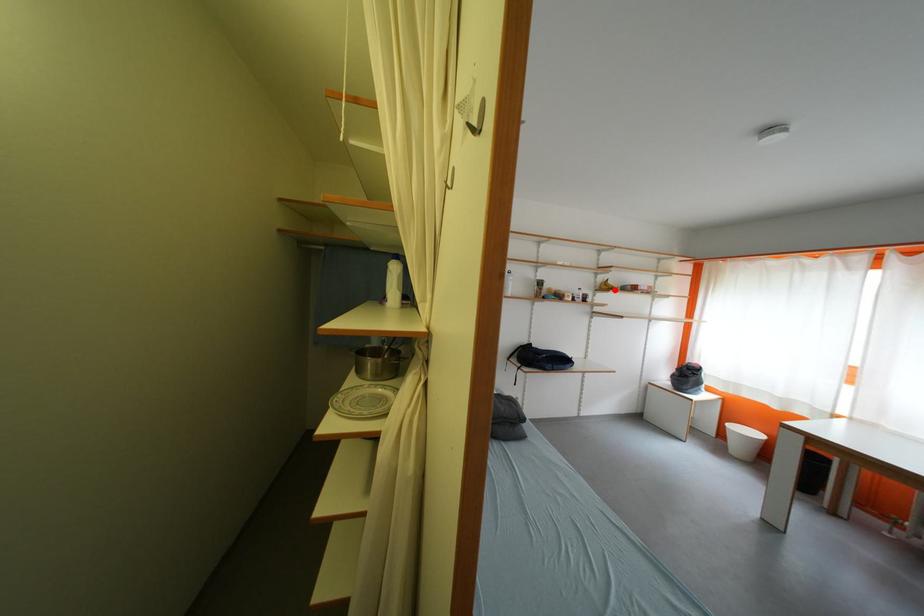
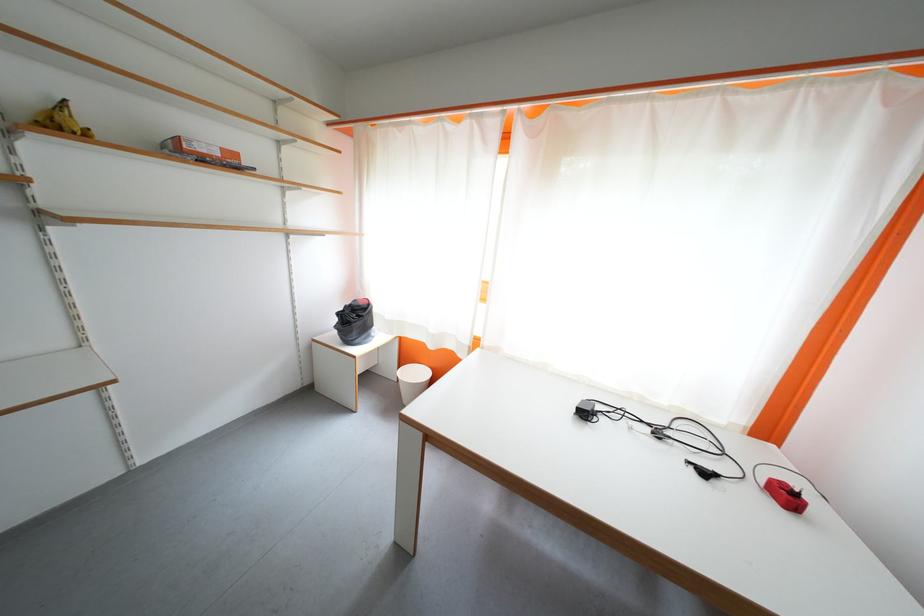
Question: I am providing you with two images of the same scene from different viewpoints. Given a red point in image1, look at the same physical point in image2. Is it:

Choices:
 (A) Closer to the viewpoint
 (B) Farther from the viewpoint

Answer: (B)